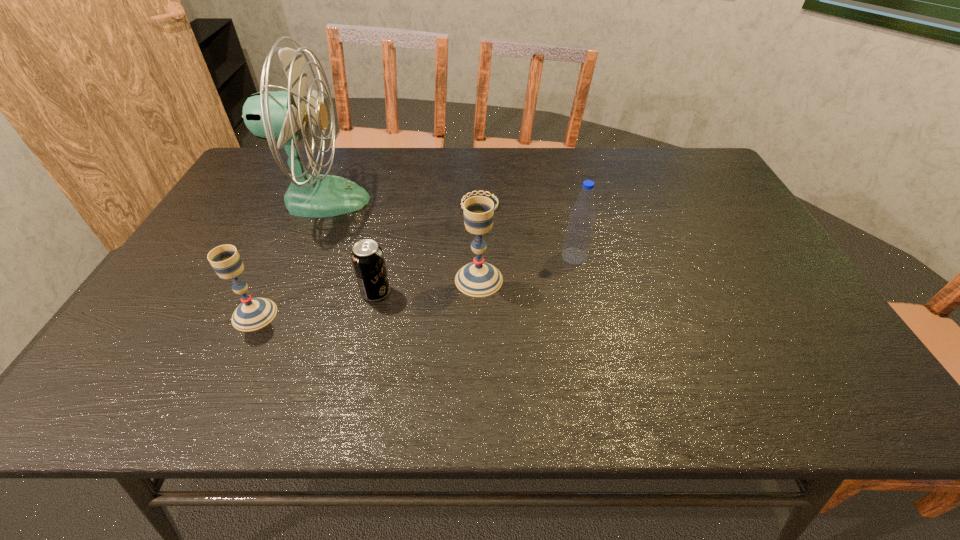
Identify the location of vacant region located on the left of the farther chalice. Image resolution: width=960 pixels, height=540 pixels. (305, 280).

The height and width of the screenshot is (540, 960). I want to click on free point located 0.390m in front of the fan, directing airflow, so click(x=499, y=200).

The width and height of the screenshot is (960, 540). I want to click on free spot located on the surface of the bracelet showing star-shaped elements, so click(603, 205).

The image size is (960, 540). What are the coordinates of `free location located 0.160m on the front of the water bottle` in the screenshot? It's located at (588, 313).

Identify the location of free space located 0.210m on the left of the third object from left to right. Image resolution: width=960 pixels, height=540 pixels. (274, 293).

Find the location of a particular element. The image size is (960, 540). object that is positioned at the far edge is located at coordinates (283, 115).

This screenshot has width=960, height=540. What are the coordinates of `object present at the near edge` in the screenshot? It's located at (254, 313).

Find the location of a particular element. The image size is (960, 540). object located in the left edge section of the desktop is located at coordinates [283, 115].

The width and height of the screenshot is (960, 540). Find the location of `object present at the far left corner`. object present at the far left corner is located at coordinates (283, 115).

At what (x,y) coordinates should I click in order to perform the action: click on vacant space at the far edge of the desktop. Please return your answer as a coordinate pair (x, y). Image resolution: width=960 pixels, height=540 pixels. Looking at the image, I should click on (535, 170).